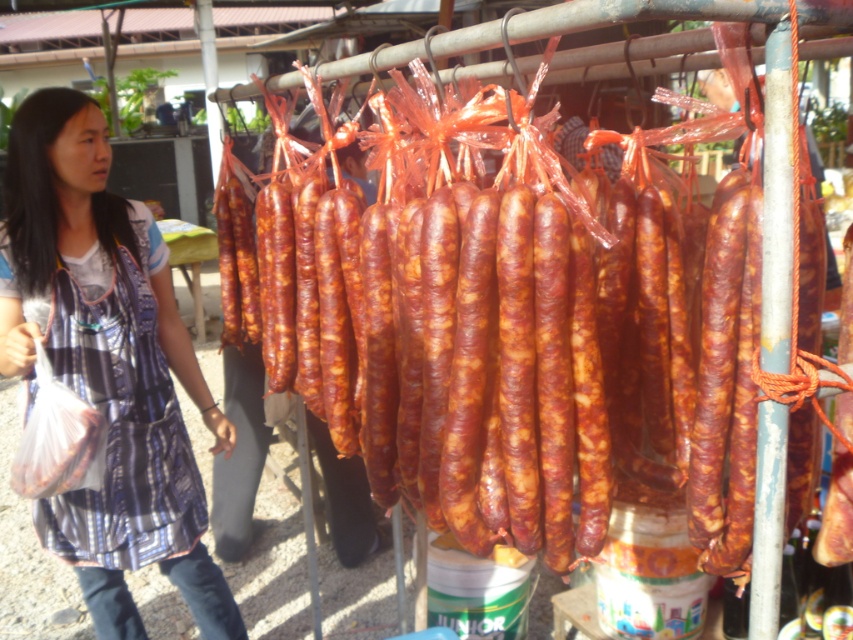
You are a vendor at the market and want to place a new sign between the brown glossy sausages at center and the plaid fabric dress at left. Considering their widths, which object should you position the sign closer to to ensure it fits properly?

The brown glossy sausages at center are wider than the plaid fabric dress at left, so the sign should be placed closer to the plaid fabric dress at left to accommodate the width difference.

You are a customer at the market and want to pick up the plaid fabric dress at left. However, the brown glossy sausages at center are blocking your path. Can you move the sausages to access the dress?

The brown glossy sausages at center are positioned over plaid fabric dress at left, meaning the sausages are above the dress. Since they are hung on a rack, you can easily reach the dress without moving the sausages by going around or underneath them.

You are a customer at the market and want to see both the brown glossy sausages at center and the plaid fabric dress at left. Which object is shorter?

The brown glossy sausages at center are shorter than the plaid fabric dress at left.